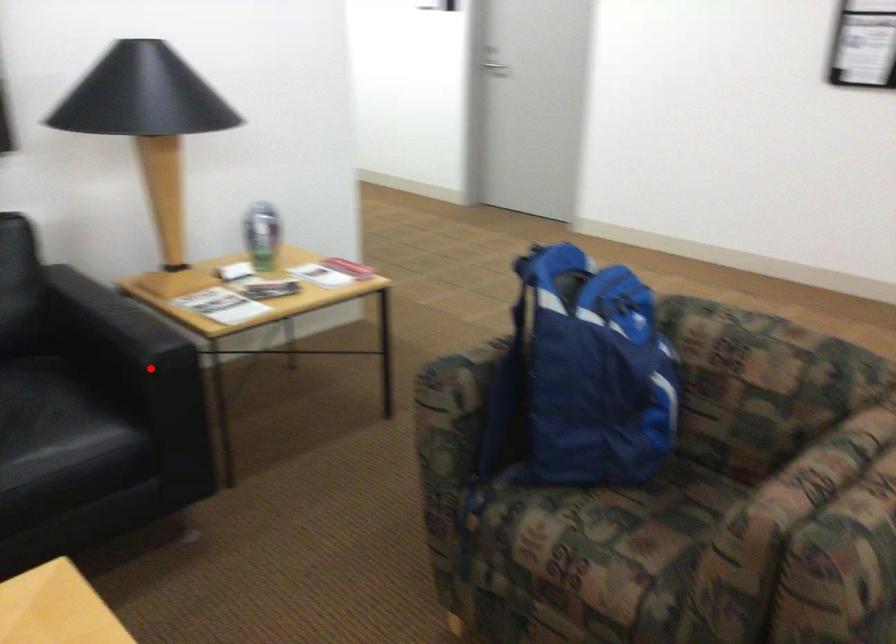
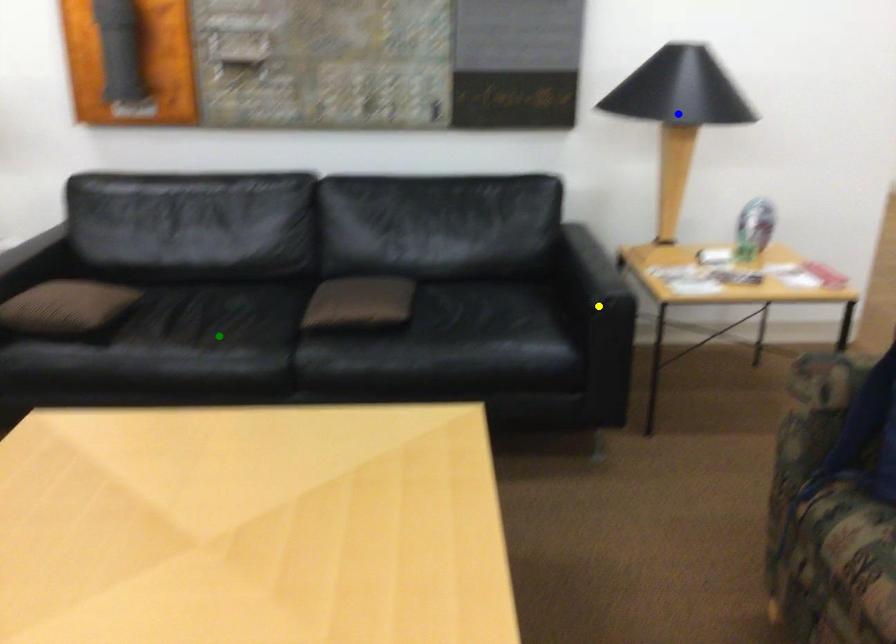
Question: I am providing you with two images of the same scene from different viewpoints. A red point is marked on the first image. You are given multiple points on the second image. In image 2, which mark is for the same physical point as the one in image 1?

Choices:
 (A) green point
 (B) yellow point
 (C) blue point

Answer: (B)